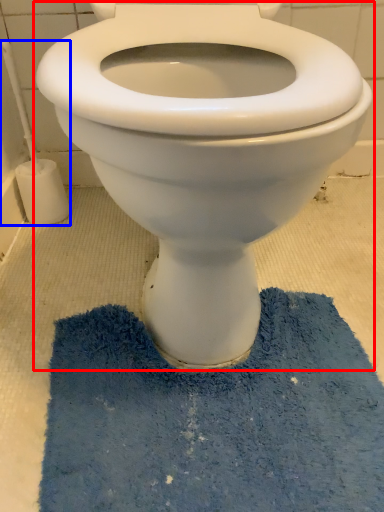
Question: Which object is closer to the camera taking this photo, toilet (highlighted by a red box) or brush (highlighted by a blue box)?

Choices:
 (A) toilet
 (B) brush

Answer: (A)